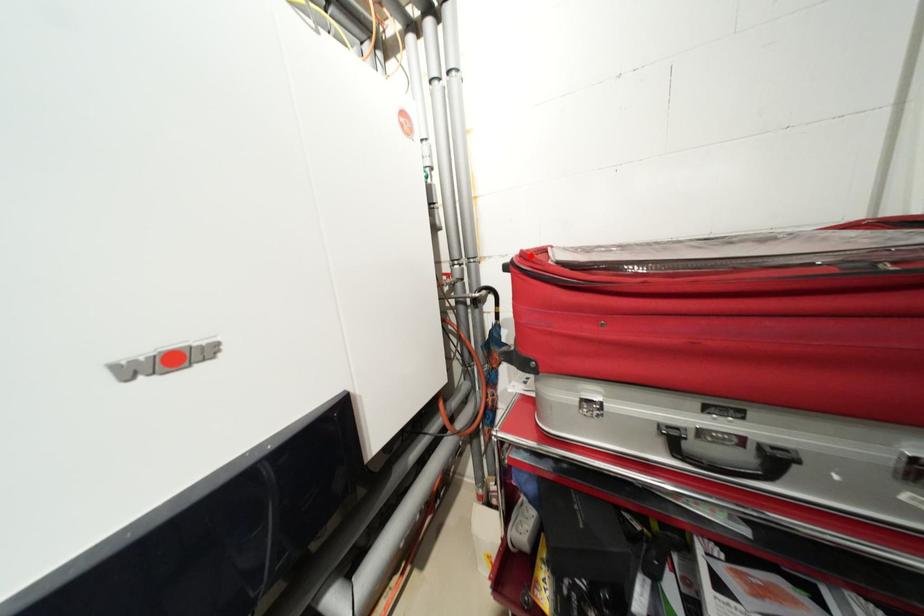
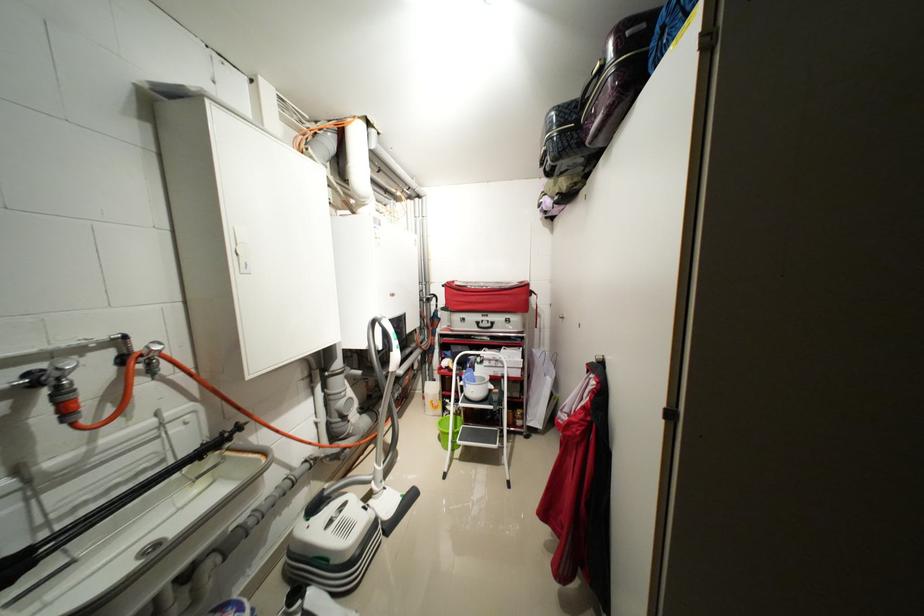
Find the pixel in the second image that matches the highlighted location in the first image.

(455, 284)